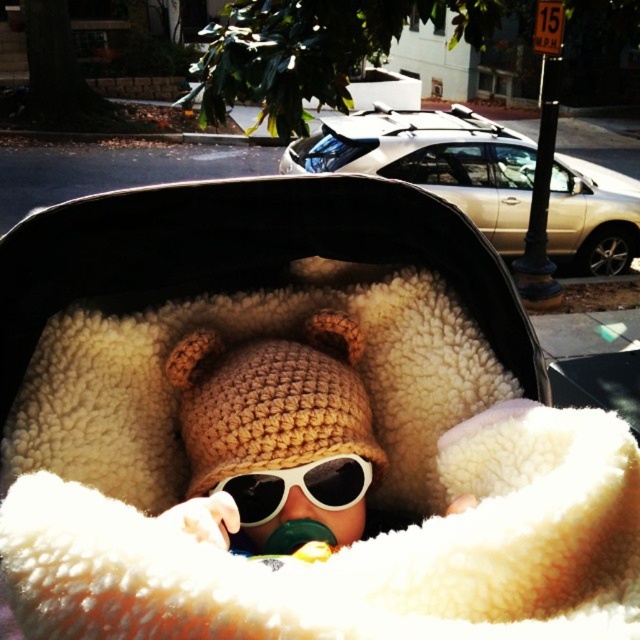
Question: Among these points, which one is farthest from the camera?

Choices:
 (A) click(x=515, y=163)
 (B) click(x=211, y=348)
 (C) click(x=266, y=481)

Answer: (A)

Question: Is crochet hat at center to the left of white plastic goggles at center from the viewer's perspective?

Choices:
 (A) no
 (B) yes

Answer: (A)

Question: Which of the following is the closest to the observer?

Choices:
 (A) white plastic goggles at center
 (B) crochet hat at center
 (C) gold metallic car at upper center
 (D) fuzzy beige baby carriage at center

Answer: (D)

Question: Among these objects, which one is farthest from the camera?

Choices:
 (A) crochet hat at center
 (B) gold metallic car at upper center

Answer: (B)

Question: Considering the relative positions of crochet hat at center and white plastic goggles at center in the image provided, where is crochet hat at center located with respect to white plastic goggles at center?

Choices:
 (A) left
 (B) right

Answer: (B)

Question: From the image, what is the correct spatial relationship of gold metallic car at upper center in relation to white plastic goggles at center?

Choices:
 (A) right
 (B) left

Answer: (A)